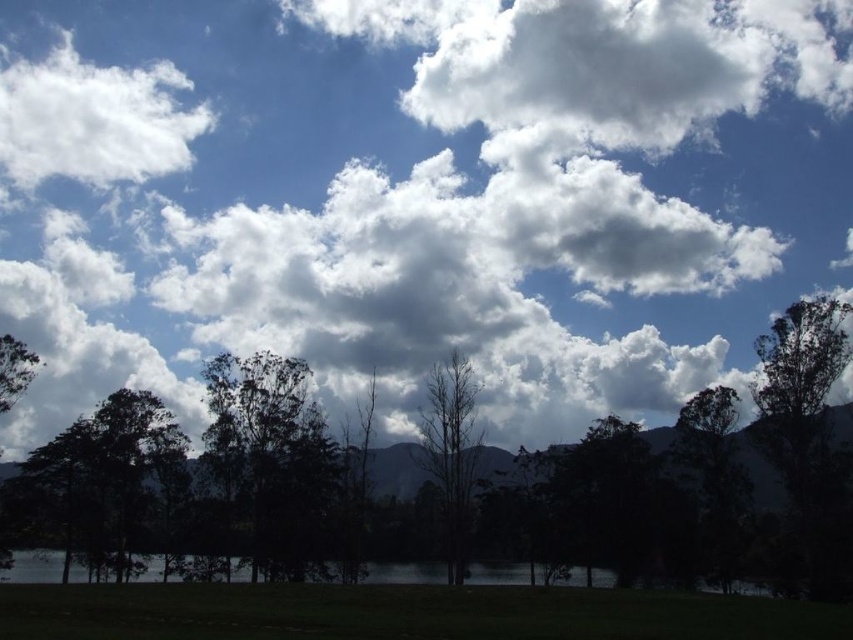
Who is higher up, white fluffy clouds at upper center or white fluffy cloud at upper left?

white fluffy cloud at upper left is higher up.

Identify the location of white fluffy clouds at upper center. (418, 196).

Between green leafy tree at center and white fluffy cloud at upper left, which one is positioned lower?

green leafy tree at center is below.

Which of these two, green leafy tree at center or white fluffy cloud at upper left, stands shorter?

green leafy tree at center is shorter.

Is point (834, 518) positioned before point (67, 125)?

Yes, point (834, 518) is closer to viewer.

Where is `green leafy tree at center`? This screenshot has width=853, height=640. green leafy tree at center is located at coordinates (485, 481).

Does point (722, 387) come closer to viewer compared to point (445, 464)?

No, (722, 387) is behind (445, 464).

Is green leafy tree at center positioned in front of bare wood tree at center?

Yes, green leafy tree at center is closer to the viewer.

Does point (253, 554) lie behind point (453, 490)?

Yes, point (253, 554) is farther from viewer.

Locate an element on the screen. green leafy tree at center is located at coordinates tap(485, 481).